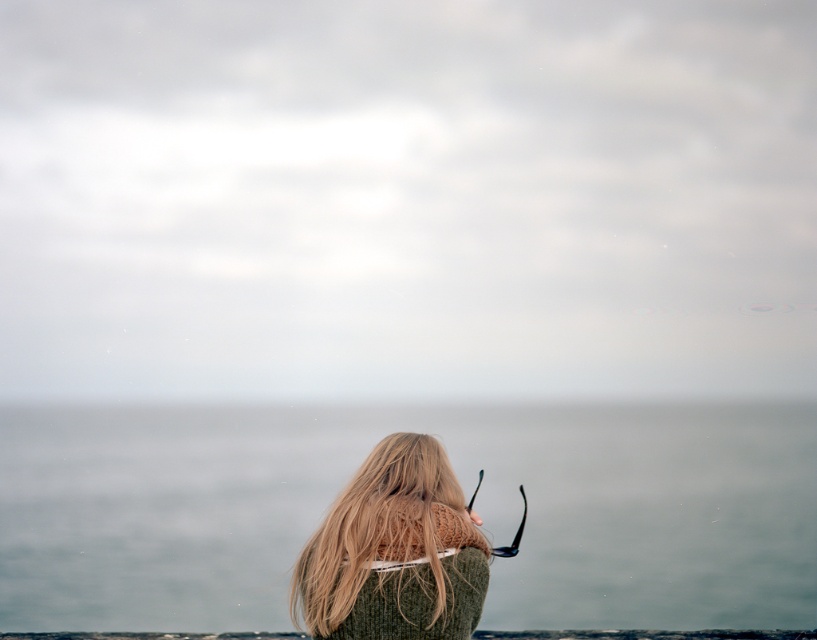
Between point (289, 474) and point (338, 588), which one is positioned in front?

Point (338, 588) is more forward.

Who is taller, gray matte water at center or blonde hair at center?

gray matte water at center is taller.

Is point (614, 598) closer to viewer compared to point (445, 588)?

That is False.

The image size is (817, 640). What are the coordinates of `gray matte water at center` in the screenshot? It's located at (461, 484).